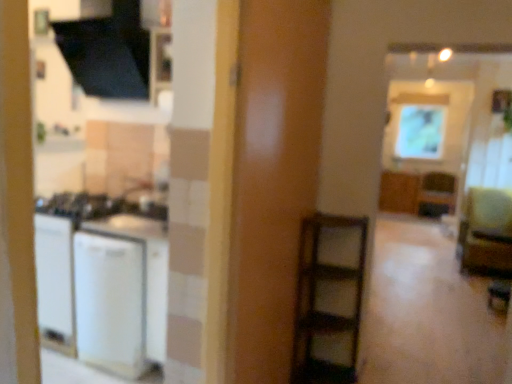
Question: Considering the relative sizes of wooden cabinet at center-right, which ranks as the second cabinetry in left-to-right order, and matte brown screen door at center in the image provided, is wooden cabinet at center-right, which ranks as the second cabinetry in left-to-right order, wider than matte brown screen door at center?

Choices:
 (A) yes
 (B) no

Answer: (A)

Question: Considering the relative sizes of wooden cabinet at center-right, which ranks as the second cabinetry in left-to-right order, and matte brown screen door at center in the image provided, is wooden cabinet at center-right, which ranks as the second cabinetry in left-to-right order, smaller than matte brown screen door at center?

Choices:
 (A) yes
 (B) no

Answer: (B)

Question: Does wooden cabinet at center-right, the first cabinetry positioned from the right, appear on the left side of matte brown screen door at center?

Choices:
 (A) yes
 (B) no

Answer: (B)

Question: Is wooden cabinet at center-right, the first cabinetry positioned from the right, positioned far away from matte brown screen door at center?

Choices:
 (A) yes
 (B) no

Answer: (A)

Question: Can you confirm if wooden cabinet at center-right, the first cabinetry positioned from the right, is positioned to the right of matte brown screen door at center?

Choices:
 (A) yes
 (B) no

Answer: (A)

Question: Considering the positions of white matte refrigerator at left and matte brown screen door at center in the image, is white matte refrigerator at left wider or thinner than matte brown screen door at center?

Choices:
 (A) thin
 (B) wide

Answer: (B)

Question: Looking at the image, does white matte refrigerator at left seem bigger or smaller compared to matte brown screen door at center?

Choices:
 (A) big
 (B) small

Answer: (A)

Question: From their relative heights in the image, would you say white matte refrigerator at left is taller or shorter than matte brown screen door at center?

Choices:
 (A) short
 (B) tall

Answer: (A)

Question: Is point 109,311 positioned closer to the camera than point 245,145?

Choices:
 (A) farther
 (B) closer

Answer: (A)

Question: Is green fabric armchair at right spatially inside matte glass window screen at upper right, or outside of it?

Choices:
 (A) outside
 (B) inside

Answer: (A)

Question: Is green fabric armchair at right bigger or smaller than matte glass window screen at upper right?

Choices:
 (A) big
 (B) small

Answer: (A)

Question: From a real-world perspective, relative to matte glass window screen at upper right, is green fabric armchair at right vertically above or below?

Choices:
 (A) below
 (B) above

Answer: (A)

Question: From their relative heights in the image, would you say green fabric armchair at right is taller or shorter than matte glass window screen at upper right?

Choices:
 (A) tall
 (B) short

Answer: (B)

Question: From the image's perspective, is matte brown screen door at center located above or below white matte refrigerator at left?

Choices:
 (A) below
 (B) above

Answer: (B)

Question: From a real-world perspective, is matte brown screen door at center above or below white matte refrigerator at left?

Choices:
 (A) below
 (B) above

Answer: (B)